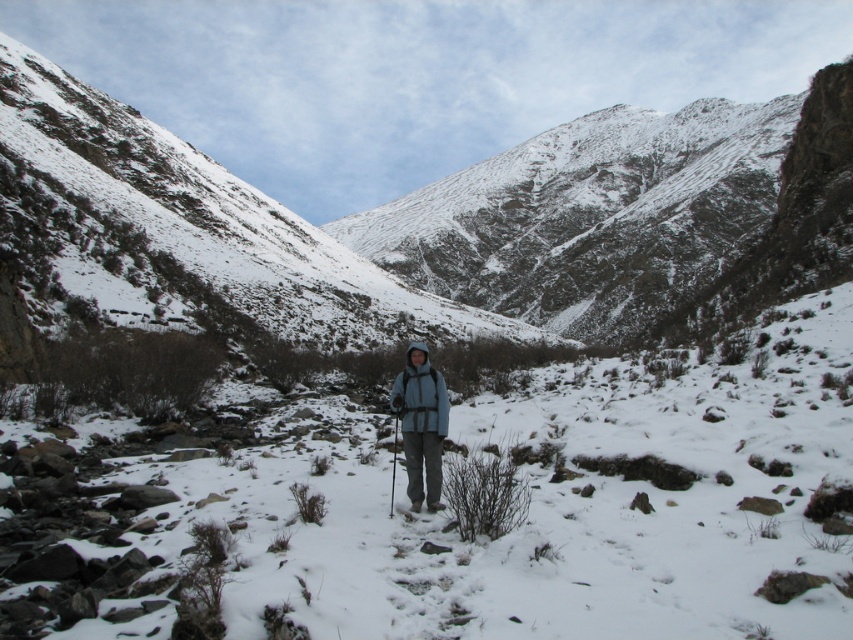
Is blue fleece jacket at center to the left of metallic silver ski pole at center from the viewer's perspective?

Incorrect, blue fleece jacket at center is not on the left side of metallic silver ski pole at center.

Can you confirm if blue fleece jacket at center is taller than metallic silver ski pole at center?

Indeed, blue fleece jacket at center has a greater height compared to metallic silver ski pole at center.

Is point (431, 456) closer to viewer compared to point (393, 486)?

That is True.

Find the location of a particular element. This screenshot has width=853, height=640. blue fleece jacket at center is located at coordinates (421, 424).